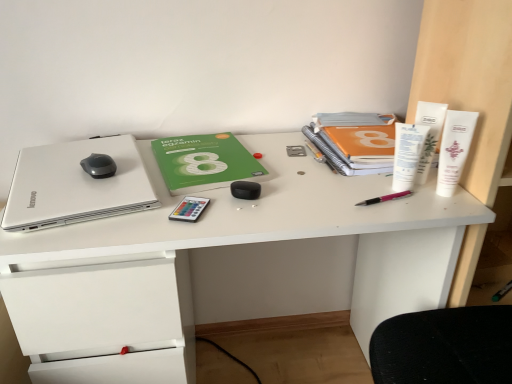
Where is `free area in between orange matte notebook at upper right, acting as the 1th paperback book starting from the right, and black plastic remote control at center-left, positioned as the fifth stationery in right-to-left order`? Image resolution: width=512 pixels, height=384 pixels. free area in between orange matte notebook at upper right, acting as the 1th paperback book starting from the right, and black plastic remote control at center-left, positioned as the fifth stationery in right-to-left order is located at coordinates (286, 175).